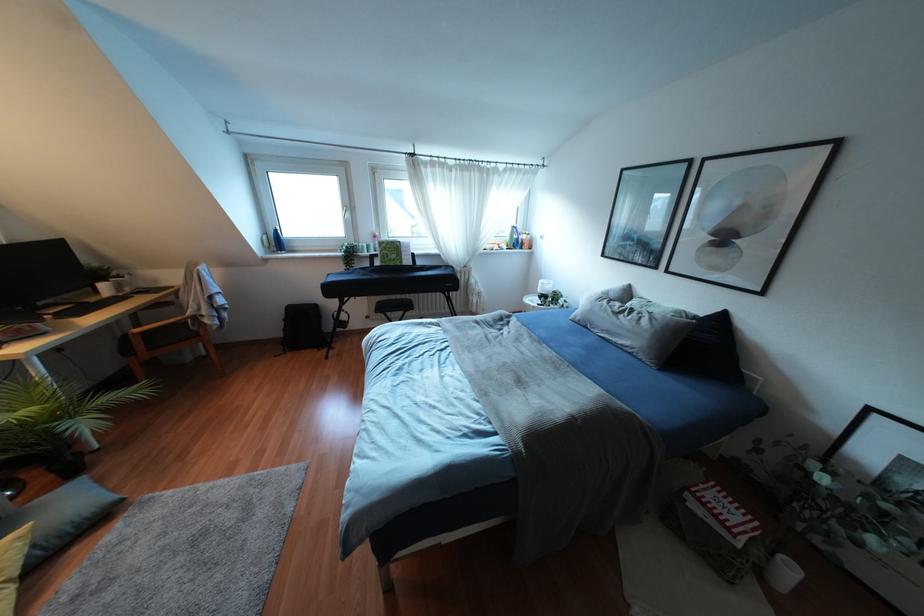
Find the location of a particular element. Image resolution: width=924 pixels, height=616 pixels. white window handle is located at coordinates (346, 211).